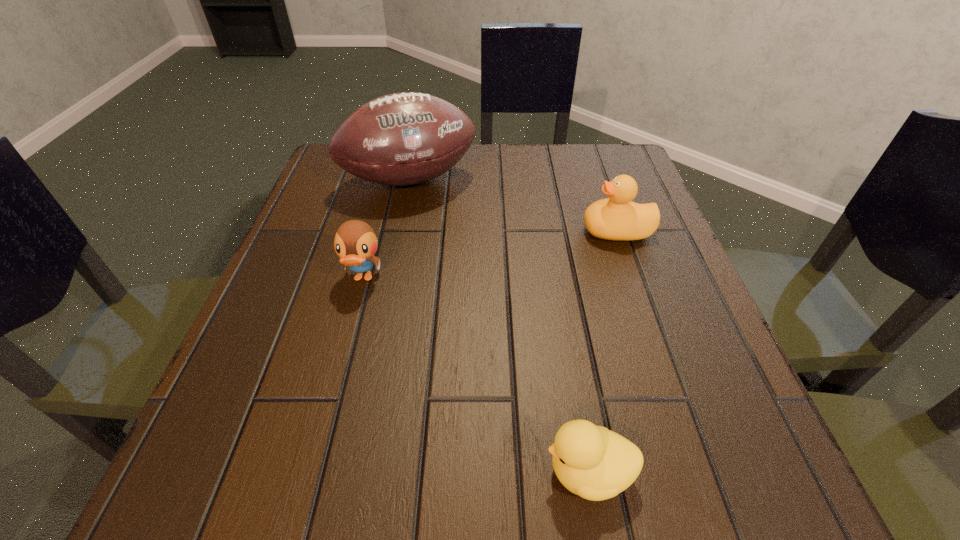
The image size is (960, 540). Identify the location of object located in the right edge section of the desktop. (618, 218).

Find the location of a particular element. object present at the far left corner is located at coordinates (407, 138).

Where is `free location at the far edge of the desktop`? free location at the far edge of the desktop is located at coordinates coord(544,172).

The image size is (960, 540). Find the location of `vacant region at the near edge of the desktop`. vacant region at the near edge of the desktop is located at coordinates (519, 463).

Locate an element on the screen. free space at the left edge of the desktop is located at coordinates (356, 301).

Locate an element on the screen. The width and height of the screenshot is (960, 540). free location at the right edge is located at coordinates click(x=651, y=320).

Find the location of a particular element. free region at the far left corner is located at coordinates (335, 165).

Find the location of a particular element. This screenshot has height=540, width=960. vacant region at the near left corner of the desktop is located at coordinates (179, 503).

The width and height of the screenshot is (960, 540). Find the location of `free area in between the shortest object and the football (American)`. free area in between the shortest object and the football (American) is located at coordinates (499, 326).

This screenshot has width=960, height=540. What are the coordinates of `free space between the nearest object and the rightmost object` in the screenshot? It's located at (603, 352).